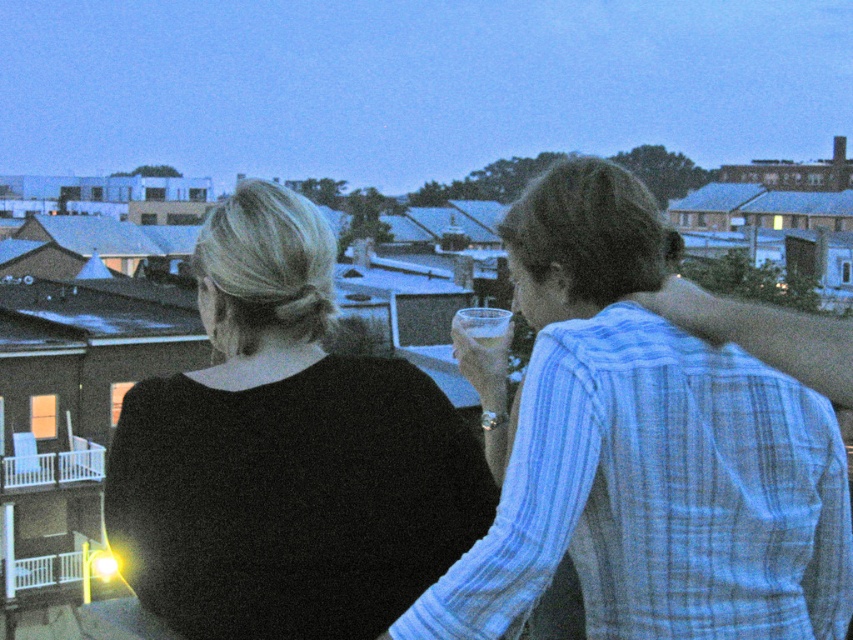
Which of these two, light blue striped shirt at upper right or black matte shirt at upper left, stands taller?

light blue striped shirt at upper right is taller.

Does light blue striped shirt at upper right have a larger size compared to black matte shirt at upper left?

Correct, light blue striped shirt at upper right is larger in size than black matte shirt at upper left.

Locate an element on the screen. light blue striped shirt at upper right is located at coordinates (645, 452).

Image resolution: width=853 pixels, height=640 pixels. Identify the location of light blue striped shirt at upper right. pos(645,452).

Can you confirm if black matte shirt at upper left is positioned to the left of clear glass at center?

Indeed, black matte shirt at upper left is positioned on the left side of clear glass at center.

Looking at this image, between black matte shirt at upper left and clear glass at center, which one appears on the right side from the viewer's perspective?

clear glass at center

Identify the location of black matte shirt at upper left. (286, 454).

Can you confirm if light blue striped shirt at upper right is shorter than clear glass at center?

No.

Is light blue striped shirt at upper right taller than clear glass at center?

Yes.

Is point (650, 285) behind point (474, 321)?

No.

Where is `light blue striped shirt at upper right`? light blue striped shirt at upper right is located at coordinates (645, 452).